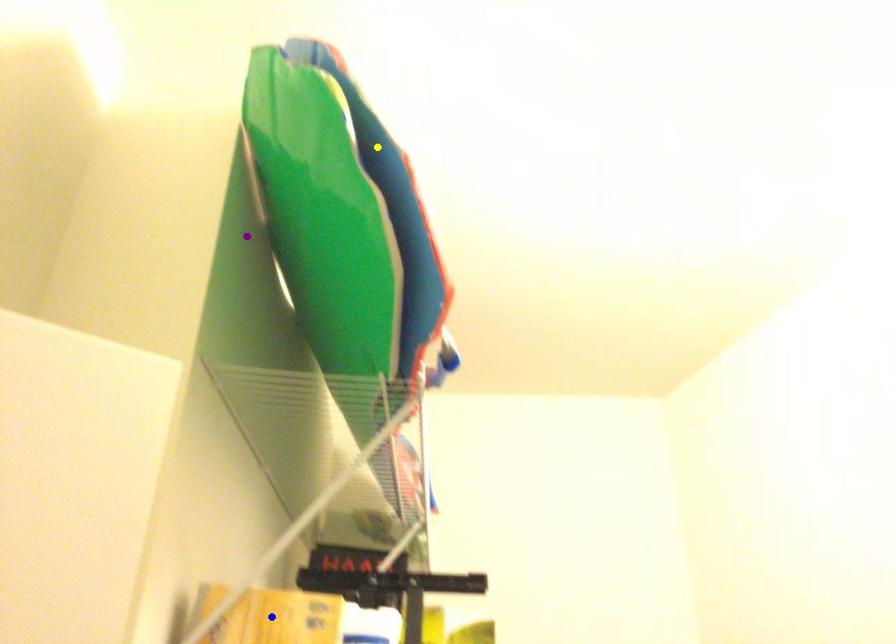
Order these from nearest to farthest:
purple point | blue point | yellow point

1. yellow point
2. blue point
3. purple point